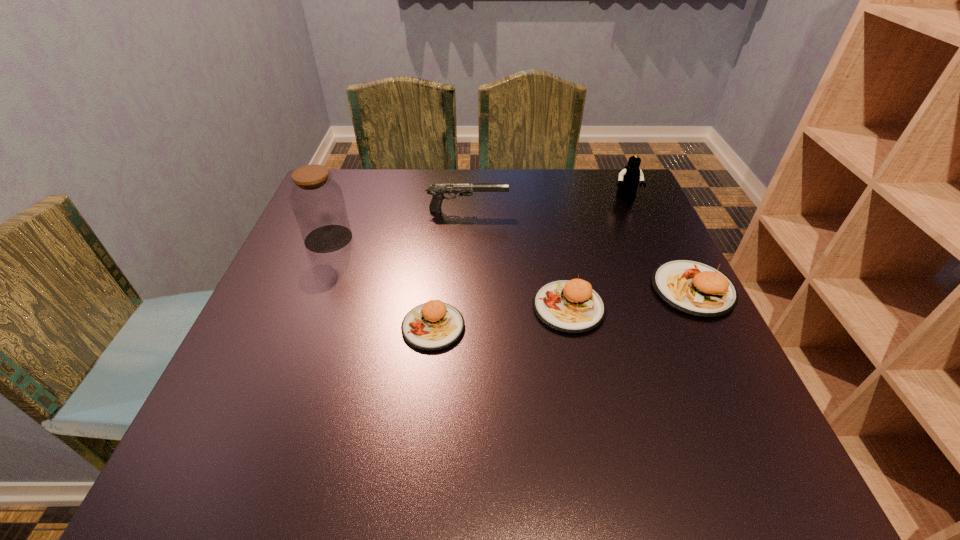
Where is `vacant region between the gun and the jar`? vacant region between the gun and the jar is located at coordinates (397, 225).

In order to click on free space between the jar and the shortest object in this screenshot , I will do point(381,283).

Image resolution: width=960 pixels, height=540 pixels. In order to click on empty location between the Lego and the tallest object in this screenshot , I will do `click(477, 218)`.

This screenshot has width=960, height=540. I want to click on free space between the gun and the rightmost patty, so click(x=580, y=250).

Find the location of `vacant space that is in between the tallest object and the rightmost patty`. vacant space that is in between the tallest object and the rightmost patty is located at coordinates (511, 264).

At what (x,y) coordinates should I click in order to perform the action: click on free point between the second patty from right to left and the rightmost patty. Please return your answer as a coordinate pair (x, y). Looking at the image, I should click on [x=631, y=299].

Choose which object is the third nearest neighbor to the leftmost patty. Please provide its 2D coordinates. Your answer should be formatted as a tuple, i.e. [(x, y)], where the tuple contains the x and y coordinates of a point satisfying the conditions above.

[(437, 191)]

Where is `object that ranks as the fifth closest to the second shortest patty`? Image resolution: width=960 pixels, height=540 pixels. object that ranks as the fifth closest to the second shortest patty is located at coordinates (317, 200).

The height and width of the screenshot is (540, 960). I want to click on patty that is the second closest to the farthest object, so click(x=571, y=306).

Identify which patty is located as the second nearest to the leftmost patty. Please provide its 2D coordinates. Your answer should be formatted as a tuple, i.e. [(x, y)], where the tuple contains the x and y coordinates of a point satisfying the conditions above.

[(692, 287)]